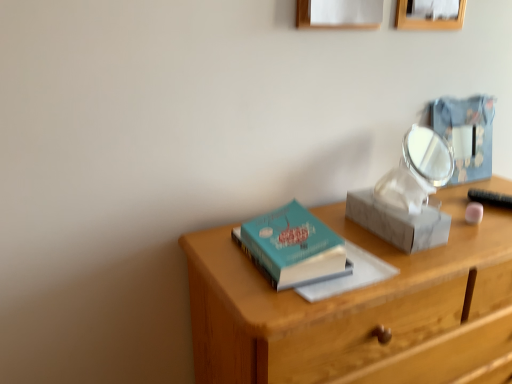
The image size is (512, 384). I want to click on vacant space to the right of teal matte hardcover book at center, so click(374, 256).